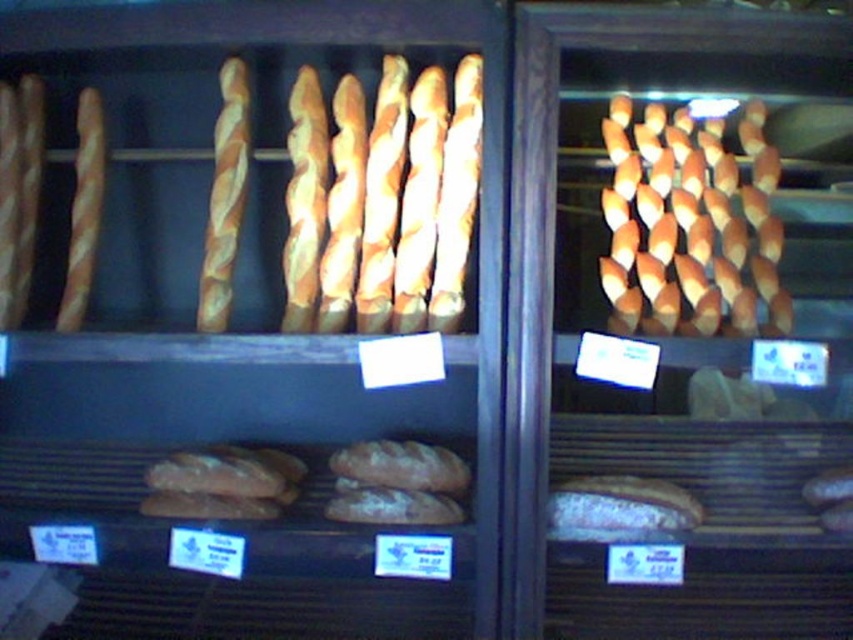
Between golden brown baguette at center and golden brown twisted bread at center, which one appears on the left side from the viewer's perspective?

golden brown twisted bread at center is more to the left.

From the picture: Is golden brown baguette at center smaller than golden brown twisted bread at center?

No, golden brown baguette at center is not smaller than golden brown twisted bread at center.

Between point (654, 211) and point (238, 131), which one is positioned behind?

Point (654, 211)

You are a GUI agent. You are given a task and a screenshot of the screen. Output one action in this format:
    pyautogui.click(x=<x>, y=<y>)
    Task: Click on the golden brown baguette at center
    The width and height of the screenshot is (853, 640).
    Given the screenshot: What is the action you would take?
    pyautogui.click(x=689, y=221)